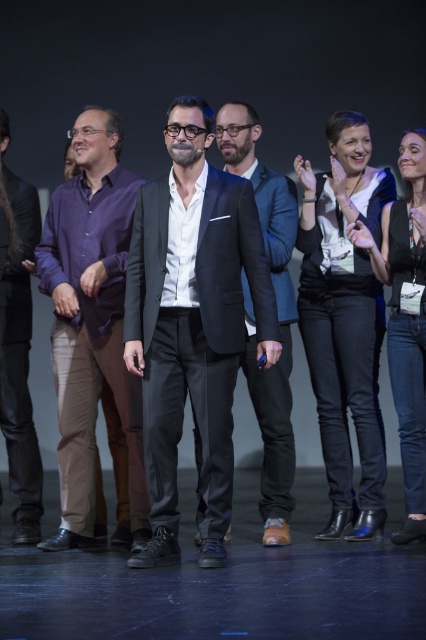
Question: Observing the image, what is the correct spatial positioning of matte black suit at center in reference to white fabric plaster bandage at center-right?

Choices:
 (A) above
 (B) below

Answer: (B)

Question: Does matte black suit at center appear on the right side of black leather jacket at right?

Choices:
 (A) yes
 (B) no

Answer: (B)

Question: Based on their relative distances, which object is nearer to the white fabric plaster bandage at center-right?

Choices:
 (A) dark blue suit at center
 (B) purple fabric shirt at left
 (C) black leather jacket at right

Answer: (C)

Question: Does white fabric plaster bandage at center-right appear on the right side of purple fabric shirt at left?

Choices:
 (A) yes
 (B) no

Answer: (A)

Question: Which object is the farthest from the black leather jacket at right?

Choices:
 (A) purple cotton shirt at left
 (B) dark blue suit at center
 (C) purple fabric shirt at left
 (D) matte black suit at center

Answer: (C)

Question: Which point appears farthest from the camera in this image?

Choices:
 (A) (282, 438)
 (B) (275, 337)
 (C) (74, 150)
 (D) (32, 499)

Answer: (D)